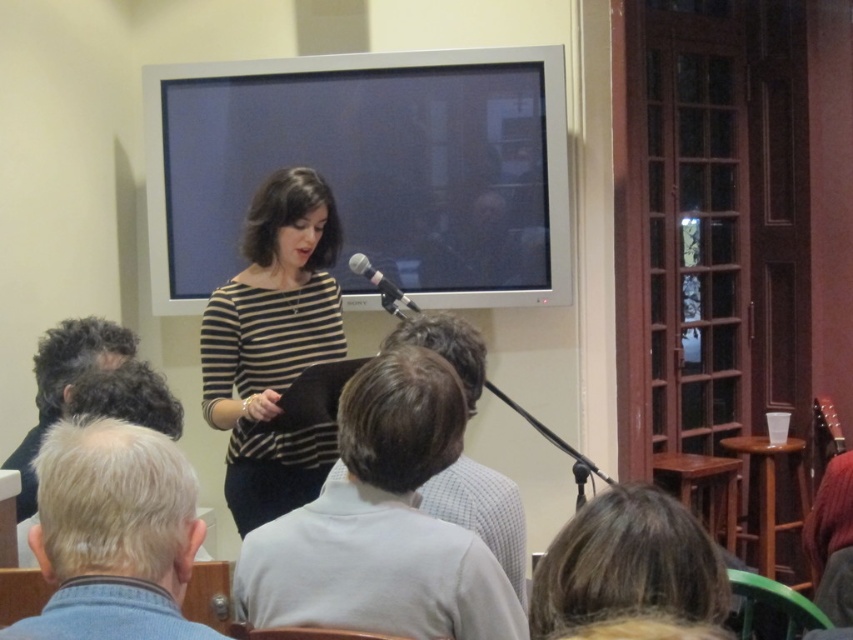
Question: Among these objects, which one is nearest to the camera?

Choices:
 (A) gray knit sweater at lower left
 (B) black metallic microphone at center
 (C) matte black laptop at center

Answer: (A)

Question: Is brown hair at lower center to the left of black metallic microphone at center from the viewer's perspective?

Choices:
 (A) no
 (B) yes

Answer: (A)

Question: Which object is closer to the camera taking this photo?

Choices:
 (A) gray fabric shirt at center
 (B) gray knit sweater at lower left
 (C) brown hair at lower center

Answer: (B)

Question: Does brown hair at lower center appear on the left side of dark curly hair at lower left?

Choices:
 (A) yes
 (B) no

Answer: (B)

Question: Considering the real-world distances, which object is closest to the brown hair at lower center?

Choices:
 (A) dark curly hair at lower left
 (B) striped fabric at center
 (C) gray fabric shirt at center
 (D) gray knit sweater at lower left

Answer: (C)

Question: Does gray fabric shirt at center have a smaller size compared to black metallic microphone at center?

Choices:
 (A) no
 (B) yes

Answer: (A)